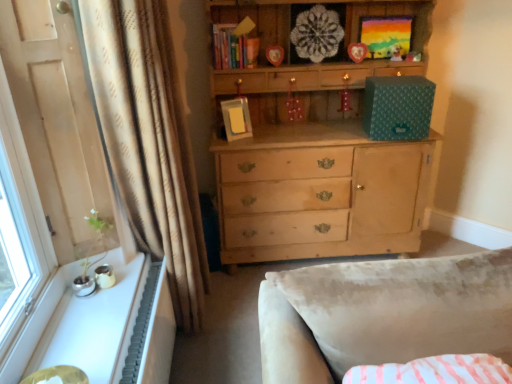
Question: Considering the relative positions of matte yellow book at upper center and white textured radiator at lower left in the image provided, is matte yellow book at upper center to the left or to the right of white textured radiator at lower left?

Choices:
 (A) right
 (B) left

Answer: (A)

Question: Would you say matte yellow book at upper center is inside or outside white textured radiator at lower left?

Choices:
 (A) outside
 (B) inside

Answer: (A)

Question: Which object is positioned closest to the matte yellow book at upper center?

Choices:
 (A) plush yellow teddy bear at upper center
 (B) white textured radiator at lower left
 (C) white glossy windowsill at lower left
 (D) beige textured curtain at left

Answer: (D)

Question: Which object is positioned closest to the matte yellow book at upper center?

Choices:
 (A) plush yellow teddy bear at upper center
 (B) white glossy windowsill at lower left
 (C) white textured radiator at lower left
 (D) beige textured curtain at left

Answer: (D)